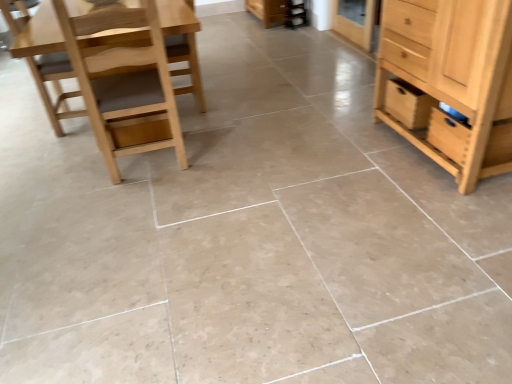
Question: Can you confirm if wooden drawer at right is wider than natural wood cabinet at right?

Choices:
 (A) no
 (B) yes

Answer: (A)

Question: Is wooden drawer at right bigger than natural wood cabinet at right?

Choices:
 (A) no
 (B) yes

Answer: (A)

Question: Are wooden drawer at right and natural wood cabinet at right far apart?

Choices:
 (A) yes
 (B) no

Answer: (B)

Question: Does wooden drawer at right contain natural wood cabinet at right?

Choices:
 (A) no
 (B) yes

Answer: (A)

Question: Can you confirm if wooden drawer at right is taller than natural wood cabinet at right?

Choices:
 (A) no
 (B) yes

Answer: (A)

Question: Is wooden drawer at right to the left of natural wood cabinet at right from the viewer's perspective?

Choices:
 (A) no
 (B) yes

Answer: (B)

Question: Can you confirm if light brown wood chair at left, acting as the 1th chair starting from the left, is smaller than light brown wood chair at left, the first chair viewed from the right?

Choices:
 (A) no
 (B) yes

Answer: (B)

Question: Would you consider light brown wood chair at left, acting as the 1th chair starting from the left, to be distant from light brown wood chair at left, marked as the 2th chair in a left-to-right arrangement?

Choices:
 (A) yes
 (B) no

Answer: (B)

Question: Does light brown wood chair at left, marked as the second chair in a right-to-left arrangement, lie in front of light brown wood chair at left, the first chair viewed from the right?

Choices:
 (A) no
 (B) yes

Answer: (A)

Question: Are light brown wood chair at left, acting as the 1th chair starting from the left, and light brown wood chair at left, the first chair viewed from the right, beside each other?

Choices:
 (A) yes
 (B) no

Answer: (B)

Question: Is light brown wood chair at left, marked as the second chair in a right-to-left arrangement, not within light brown wood chair at left, the first chair viewed from the right?

Choices:
 (A) no
 (B) yes

Answer: (B)

Question: Considering the relative sizes of light brown wood chair at left, acting as the 1th chair starting from the left, and light brown wood chair at left, marked as the 2th chair in a left-to-right arrangement, in the image provided, is light brown wood chair at left, acting as the 1th chair starting from the left, shorter than light brown wood chair at left, marked as the 2th chair in a left-to-right arrangement,?

Choices:
 (A) no
 (B) yes

Answer: (B)

Question: Does natural wood cabinet at right touch light brown wood chair at left, marked as the 2th chair in a left-to-right arrangement?

Choices:
 (A) yes
 (B) no

Answer: (B)